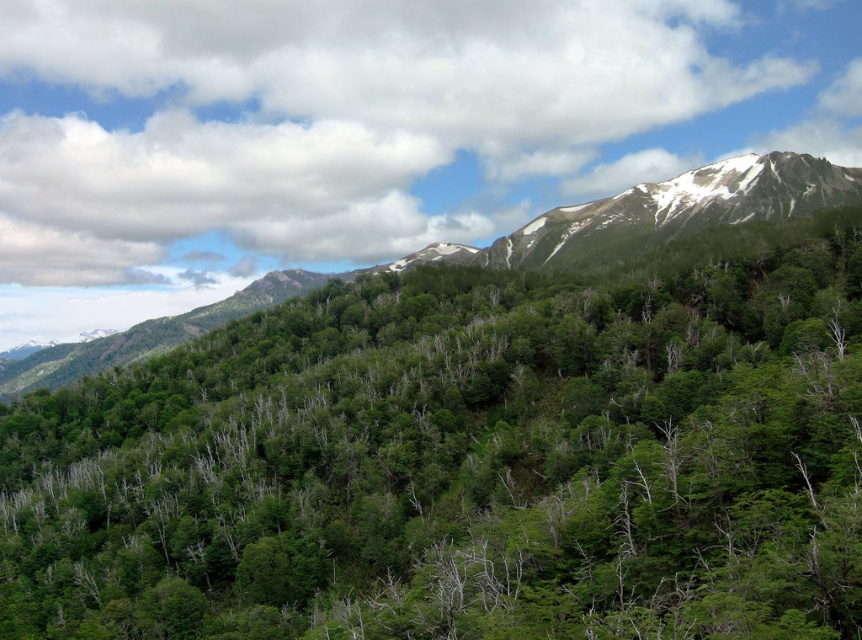
Question: Among these objects, which one is nearest to the camera?

Choices:
 (A) green leafy tree at center
 (B) green leafy forest at upper center

Answer: (A)

Question: Is green leafy tree at center to the right of green leafy forest at upper center from the viewer's perspective?

Choices:
 (A) no
 (B) yes

Answer: (B)

Question: Which object appears closest to the camera in this image?

Choices:
 (A) green leafy tree at center
 (B) green leafy forest at upper center

Answer: (A)

Question: Is green leafy tree at center above green leafy forest at upper center?

Choices:
 (A) no
 (B) yes

Answer: (A)

Question: Is green leafy tree at center further to camera compared to green leafy forest at upper center?

Choices:
 (A) yes
 (B) no

Answer: (B)